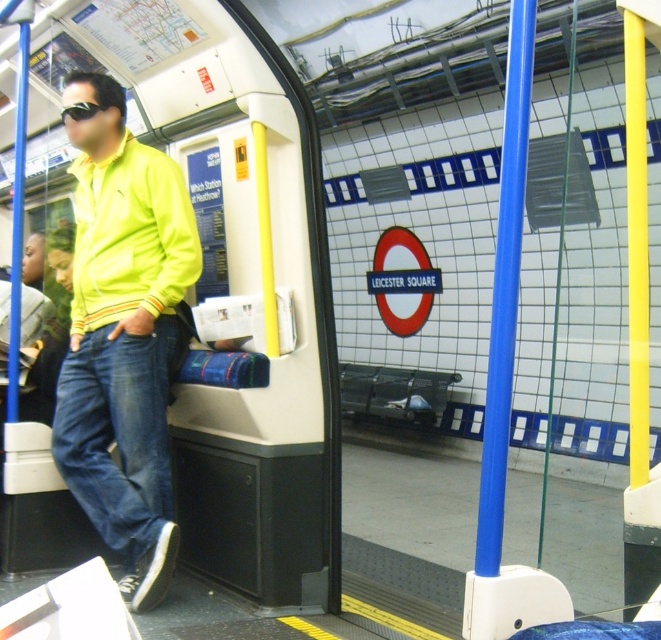
Does denim at left have a smaller size compared to neon yellow fabric jacket at left?

Indeed, denim at left has a smaller size compared to neon yellow fabric jacket at left.

Can you confirm if denim at left is wider than neon yellow fabric jacket at left?

Incorrect, denim at left's width does not surpass neon yellow fabric jacket at left's.

Find the location of a particular element. The image size is (661, 640). denim at left is located at coordinates (x=118, y=433).

Can you confirm if neon yellow jacket at left is positioned below black rubber goggles at upper left?

Correct, neon yellow jacket at left is located below black rubber goggles at upper left.

From the picture: Between neon yellow jacket at left and black rubber goggles at upper left, which one has more height?

With more height is neon yellow jacket at left.

Is point (104, 120) positioned in front of point (73, 106)?

No, (104, 120) is further to viewer.

You are a GUI agent. You are given a task and a screenshot of the screen. Output one action in this format:
    pyautogui.click(x=<x>, y=<y>)
    Task: Click on the neon yellow jacket at left
    The height and width of the screenshot is (640, 661).
    Given the screenshot: What is the action you would take?
    pyautogui.click(x=124, y=336)

Is neon yellow fabric jacket at left positioned at the back of black rubber goggles at upper left?

No, it is in front of black rubber goggles at upper left.

Is point (145, 161) behind point (93, 115)?

No, (145, 161) is closer to viewer.

This screenshot has height=640, width=661. Identify the location of neon yellow fabric jacket at left. (130, 236).